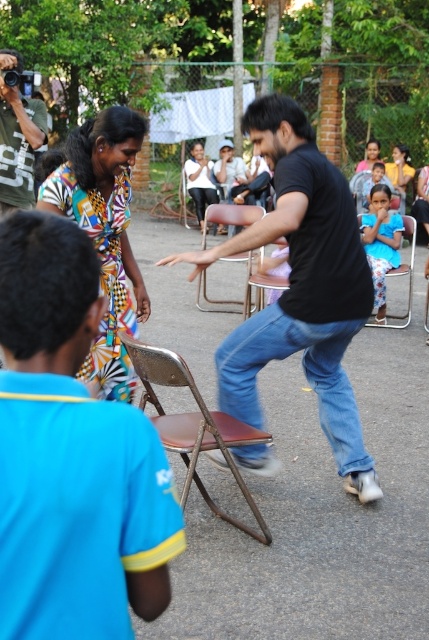
You are organizing a clothing sale and have two shirts available. The black matte shirt at center and the green textured shirt at upper left. A customer wants to know which shirt is larger. Which one should you recommend?

The black matte shirt at center is bigger than the green textured shirt at upper left, so you should recommend the black matte shirt at center.

You are at a community event and want to sit down. There is a black matte shirt at center and a brown leather chair at center. Which object is located behind the other?

The brown leather chair at center is behind the black matte shirt at center.

You are standing at the origin point of the coordinate system in the image. Where is the black matte shirt at center located?

The black matte shirt at center is located at the 2D coordinates point (301, 288).